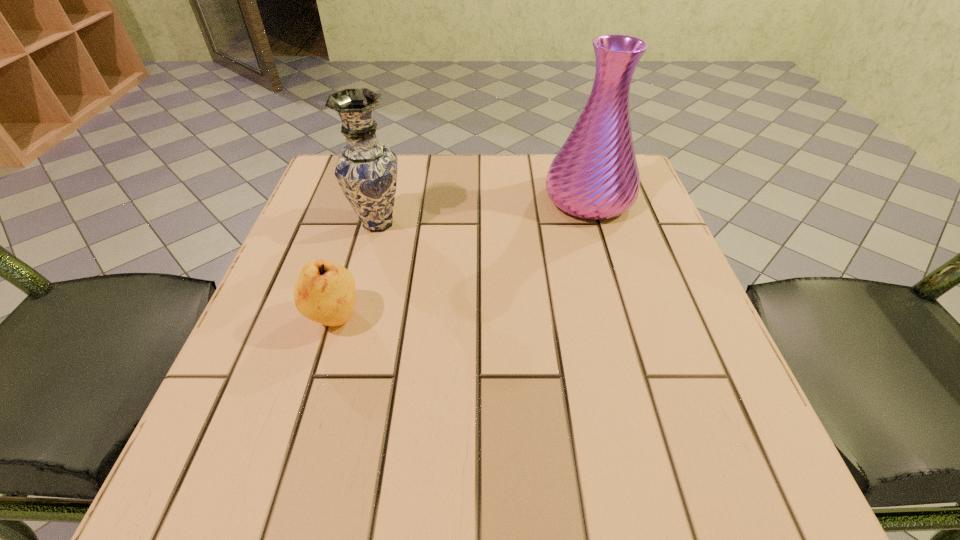
Where is `free area in between the second shortest object and the pear`? The image size is (960, 540). free area in between the second shortest object and the pear is located at coordinates (356, 271).

At what (x,y) coordinates should I click in order to perform the action: click on object that can be found as the second closest to the shorter vase. Please return your answer as a coordinate pair (x, y). The height and width of the screenshot is (540, 960). Looking at the image, I should click on (595, 175).

Identify which object is the nearest to the tallest object. Please provide its 2D coordinates. Your answer should be formatted as a tuple, i.e. [(x, y)], where the tuple contains the x and y coordinates of a point satisfying the conditions above.

[(366, 170)]

This screenshot has width=960, height=540. What are the coordinates of `vacant point that satisfies the following two spatial constraints: 1. on the back side of the pear; 2. on the right side of the shorter vase` in the screenshot? It's located at (363, 224).

Locate an element on the screen. The width and height of the screenshot is (960, 540). free space that satisfies the following two spatial constraints: 1. on the back side of the rightmost object; 2. on the right side of the left vase is located at coordinates (384, 199).